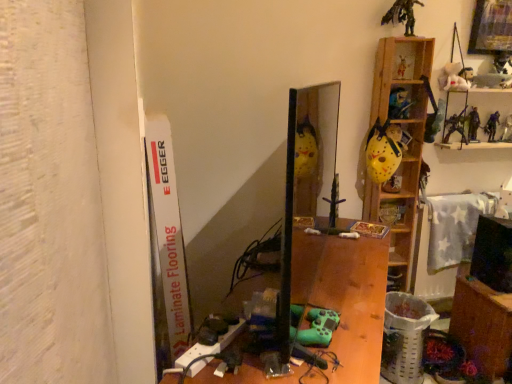
Question: Can you confirm if wooden at right, acting as the third shelf starting from the top, is thinner than yellow matte helmet at upper right, positioned as the second shelf in bottom-to-top order?

Choices:
 (A) yes
 (B) no

Answer: (B)

Question: Is wooden at right, marked as the first shelf in a bottom-to-top arrangement, wider than yellow matte helmet at upper right, positioned as the second shelf in bottom-to-top order?

Choices:
 (A) yes
 (B) no

Answer: (A)

Question: From the image's perspective, is wooden at right, acting as the third shelf starting from the top, located above yellow matte helmet at upper right, positioned as the second shelf in bottom-to-top order?

Choices:
 (A) yes
 (B) no

Answer: (B)

Question: From the image's perspective, is wooden at right, marked as the first shelf in a bottom-to-top arrangement, beneath yellow matte helmet at upper right, which is the second shelf in top-to-bottom order?

Choices:
 (A) no
 (B) yes

Answer: (B)

Question: Does wooden at right, marked as the first shelf in a bottom-to-top arrangement, touch yellow matte helmet at upper right, positioned as the second shelf in bottom-to-top order?

Choices:
 (A) no
 (B) yes

Answer: (A)

Question: Relative to wooden desk at center, is yellow matte helmet at upper right, positioned as the second shelf in bottom-to-top order, in front or behind?

Choices:
 (A) behind
 (B) front

Answer: (A)

Question: In the image, is yellow matte helmet at upper right, positioned as the second shelf in bottom-to-top order, on the left side or the right side of wooden desk at center?

Choices:
 (A) right
 (B) left

Answer: (A)

Question: In terms of height, does yellow matte helmet at upper right, positioned as the second shelf in bottom-to-top order, look taller or shorter compared to wooden desk at center?

Choices:
 (A) short
 (B) tall

Answer: (A)

Question: Considering the positions of yellow matte helmet at upper right, positioned as the second shelf in bottom-to-top order, and wooden desk at center in the image, is yellow matte helmet at upper right, positioned as the second shelf in bottom-to-top order, bigger or smaller than wooden desk at center?

Choices:
 (A) small
 (B) big

Answer: (A)

Question: From the image's perspective, is wooden desk at center located above or below white laminate flooring at left?

Choices:
 (A) below
 (B) above

Answer: (A)

Question: From a real-world perspective, relative to white laminate flooring at left, is wooden desk at center vertically above or below?

Choices:
 (A) above
 (B) below

Answer: (B)

Question: Considering the relative positions of wooden desk at center and white laminate flooring at left in the image provided, is wooden desk at center to the left or to the right of white laminate flooring at left?

Choices:
 (A) right
 (B) left

Answer: (A)

Question: Considering the positions of point (316, 251) and point (182, 240), is point (316, 251) closer or farther from the camera than point (182, 240)?

Choices:
 (A) closer
 (B) farther

Answer: (A)

Question: Which is correct: wooden at right, marked as the first shelf in a bottom-to-top arrangement, is inside yellow matte helmet at upper right, positioned as the second shelf in bottom-to-top order, or outside of it?

Choices:
 (A) inside
 (B) outside

Answer: (B)

Question: From the image's perspective, is wooden at right, marked as the first shelf in a bottom-to-top arrangement, positioned above or below yellow matte helmet at upper right, which is the second shelf in top-to-bottom order?

Choices:
 (A) below
 (B) above

Answer: (A)